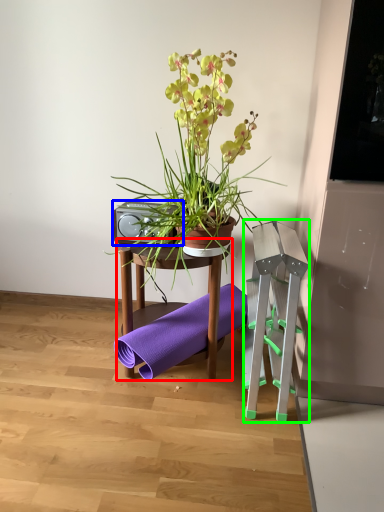
Question: Which object is positioned closest to table (highlighted by a red box)? Select from speaker (highlighted by a blue box) and step stool (highlighted by a green box).

Choices:
 (A) speaker
 (B) step stool

Answer: (A)